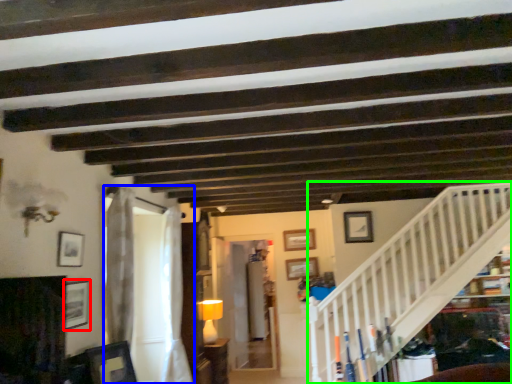
Question: Estimate the real-world distances between objects in this image. Which object is closer to picture frame (highlighted by a red box), curtain (highlighted by a blue box) or stairwell (highlighted by a green box)?

Choices:
 (A) curtain
 (B) stairwell

Answer: (A)